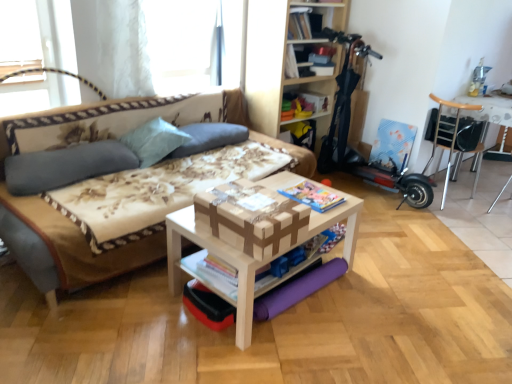
Question: Is light blue fabric pillow at upper left, acting as the second pillow starting from the left, at the right side of wooden bookshelf at upper center?

Choices:
 (A) yes
 (B) no

Answer: (B)

Question: Is light blue fabric pillow at upper left, the second pillow in the right-to-left sequence, oriented away from wooden bookshelf at upper center?

Choices:
 (A) yes
 (B) no

Answer: (B)

Question: Does light blue fabric pillow at upper left, the second pillow in the right-to-left sequence, have a greater height compared to wooden bookshelf at upper center?

Choices:
 (A) yes
 (B) no

Answer: (B)

Question: Does light blue fabric pillow at upper left, the second pillow in the right-to-left sequence, have a larger size compared to wooden bookshelf at upper center?

Choices:
 (A) no
 (B) yes

Answer: (A)

Question: From a real-world perspective, is light blue fabric pillow at upper left, the second pillow in the right-to-left sequence, located beneath wooden bookshelf at upper center?

Choices:
 (A) yes
 (B) no

Answer: (A)

Question: From the image's perspective, is light blue fabric pillow at upper left, acting as the second pillow starting from the left, below wooden bookshelf at upper center?

Choices:
 (A) no
 (B) yes

Answer: (B)

Question: From a real-world perspective, is brown cardboard box at center positioned under matte paper magazine at center, the first magazine in the right-to-left sequence, based on gravity?

Choices:
 (A) yes
 (B) no

Answer: (B)

Question: Can we say brown cardboard box at center lies outside matte paper magazine at center, which is the 1th magazine from top to bottom?

Choices:
 (A) no
 (B) yes

Answer: (B)

Question: Is brown cardboard box at center closer to the viewer compared to matte paper magazine at center, the first magazine in the right-to-left sequence?

Choices:
 (A) yes
 (B) no

Answer: (A)

Question: Considering the relative sizes of brown cardboard box at center and matte paper magazine at center, which is the 1th magazine from top to bottom, in the image provided, is brown cardboard box at center shorter than matte paper magazine at center, which is the 1th magazine from top to bottom,?

Choices:
 (A) yes
 (B) no

Answer: (B)

Question: Is brown cardboard box at center not close to matte paper magazine at center, the second magazine from the bottom?

Choices:
 (A) no
 (B) yes

Answer: (A)

Question: Is brown cardboard box at center at the left side of matte paper magazine at center, the first magazine in the right-to-left sequence?

Choices:
 (A) no
 (B) yes

Answer: (B)

Question: Is matte gray pillow at left, which is the third pillow from right to left, far from light blue fabric pillow at upper left, acting as the second pillow starting from the left?

Choices:
 (A) yes
 (B) no

Answer: (B)